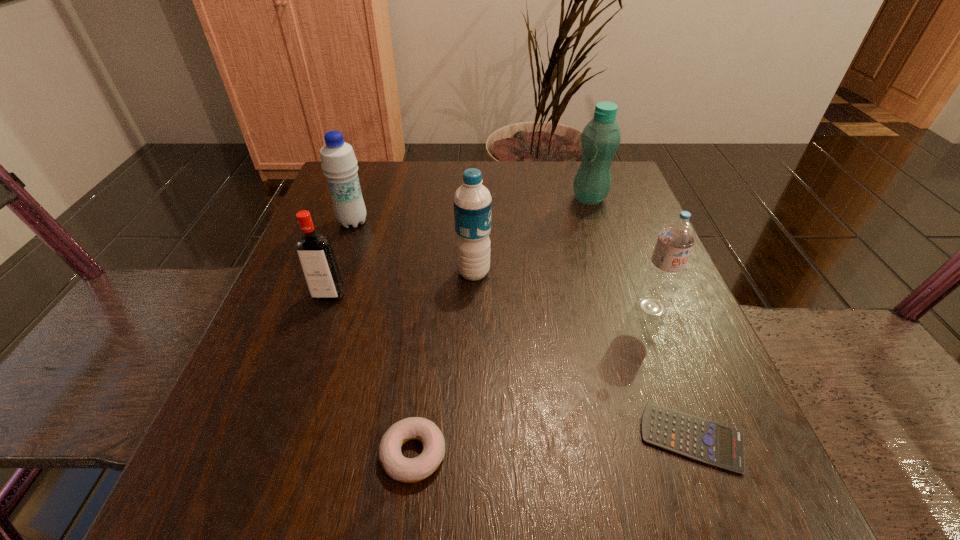
Locate an element on the screen. The height and width of the screenshot is (540, 960). calculator present at the near edge is located at coordinates (697, 438).

In order to click on water bottle that is at the left edge in this screenshot , I will do coord(338,161).

Image resolution: width=960 pixels, height=540 pixels. In order to click on vodka at the left edge in this screenshot , I will do `click(316, 257)`.

You are a GUI agent. You are given a task and a screenshot of the screen. Output one action in this format:
    pyautogui.click(x=<x>, y=<y>)
    Task: Click on the calculator that is at the right edge
    This screenshot has width=960, height=540.
    Given the screenshot: What is the action you would take?
    pyautogui.click(x=697, y=438)

Identify the location of object situated at the far left corner. (338, 161).

Where is `object situated at the far right corner`? Image resolution: width=960 pixels, height=540 pixels. object situated at the far right corner is located at coordinates (600, 139).

This screenshot has width=960, height=540. What are the coordinates of `object located at the near right corner` in the screenshot? It's located at (697, 438).

The image size is (960, 540). In order to click on vacant space at the far edge of the desktop in this screenshot , I will do coord(510,174).

Where is `vacant space at the near edge`? vacant space at the near edge is located at coordinates (616, 468).

Locate an element on the screen. This screenshot has width=960, height=540. free region at the left edge of the desktop is located at coordinates (380, 248).